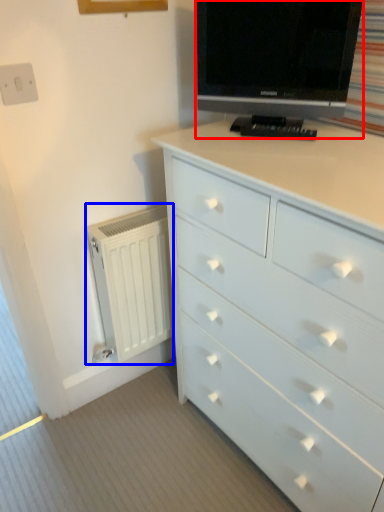
Question: Which object is closer to the camera taking this photo, television (highlighted by a red box) or radiator (highlighted by a blue box)?

Choices:
 (A) television
 (B) radiator

Answer: (A)